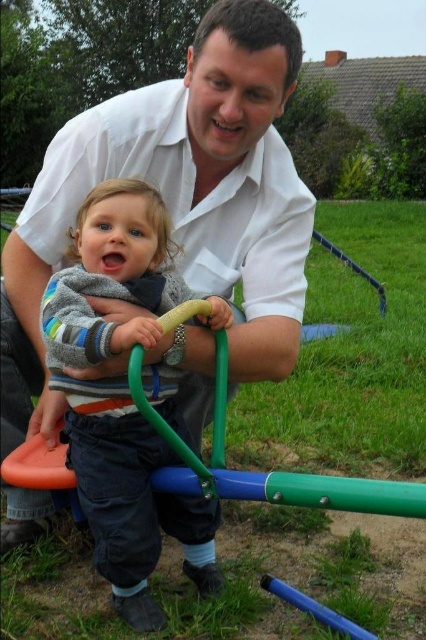
Is striped cotton sweater at center positioned at the back of green plastic bar at center?

Yes, it is.

Can you confirm if striped cotton sweater at center is bigger than green plastic bar at center?

Incorrect, striped cotton sweater at center is not larger than green plastic bar at center.

This screenshot has height=640, width=426. Describe the element at coordinates (121, 396) in the screenshot. I see `striped cotton sweater at center` at that location.

Identify the location of striped cotton sweater at center. The width and height of the screenshot is (426, 640). (121, 396).

Does white smooth shirt at upper center appear on the left side of green plastic bar at center?

Indeed, white smooth shirt at upper center is positioned on the left side of green plastic bar at center.

What do you see at coordinates (178, 202) in the screenshot?
I see `white smooth shirt at upper center` at bounding box center [178, 202].

What are the coordinates of `white smooth shirt at upper center` in the screenshot? It's located at (178, 202).

The image size is (426, 640). In order to click on white smooth shirt at upper center in this screenshot , I will do `click(178, 202)`.

Is white smooth shirt at upper center behind striped cotton sweater at center?

Yes, white smooth shirt at upper center is behind striped cotton sweater at center.

Does white smooth shirt at upper center have a lesser height compared to striped cotton sweater at center?

Incorrect, white smooth shirt at upper center's height does not fall short of striped cotton sweater at center's.

Is point (9, 253) positioned in front of point (129, 294)?

No, it is not.

What are the coordinates of `white smooth shirt at upper center` in the screenshot? It's located at (178, 202).